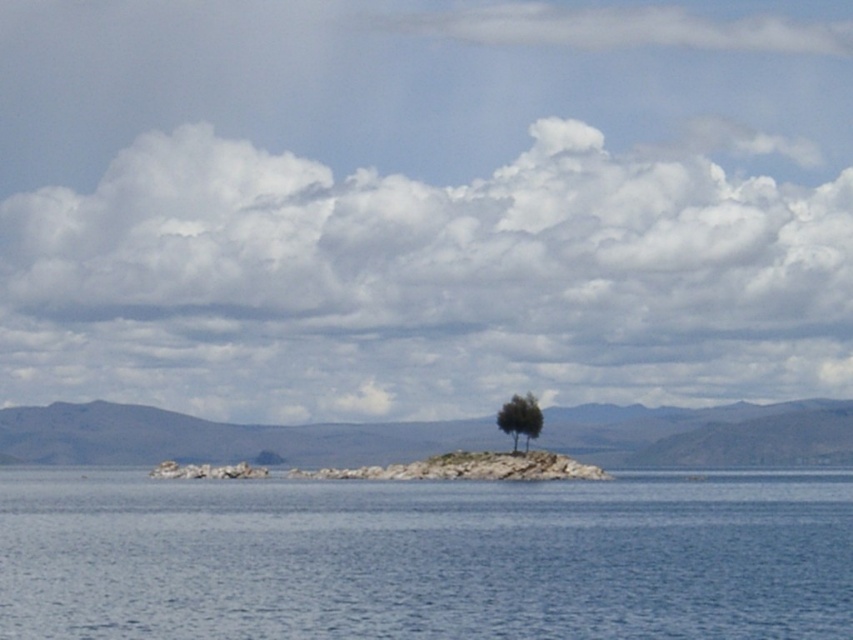
Measure the distance between clear blue water at center and green leafy tree at center.

clear blue water at center and green leafy tree at center are 170.24 feet apart.

Can you confirm if clear blue water at center is positioned below green leafy tree at center?

Yes.

This screenshot has height=640, width=853. I want to click on clear blue water at center, so click(426, 557).

You are a GUI agent. You are given a task and a screenshot of the screen. Output one action in this format:
    pyautogui.click(x=<x>, y=<y>)
    Task: Click on the clear blue water at center
    The width and height of the screenshot is (853, 640).
    Given the screenshot: What is the action you would take?
    pyautogui.click(x=426, y=557)